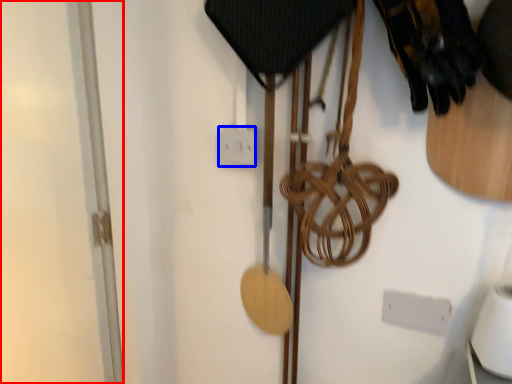
Question: Which object is closer to the camera taking this photo, glass door (highlighted by a red box) or electric outlet (highlighted by a blue box)?

Choices:
 (A) glass door
 (B) electric outlet

Answer: (A)